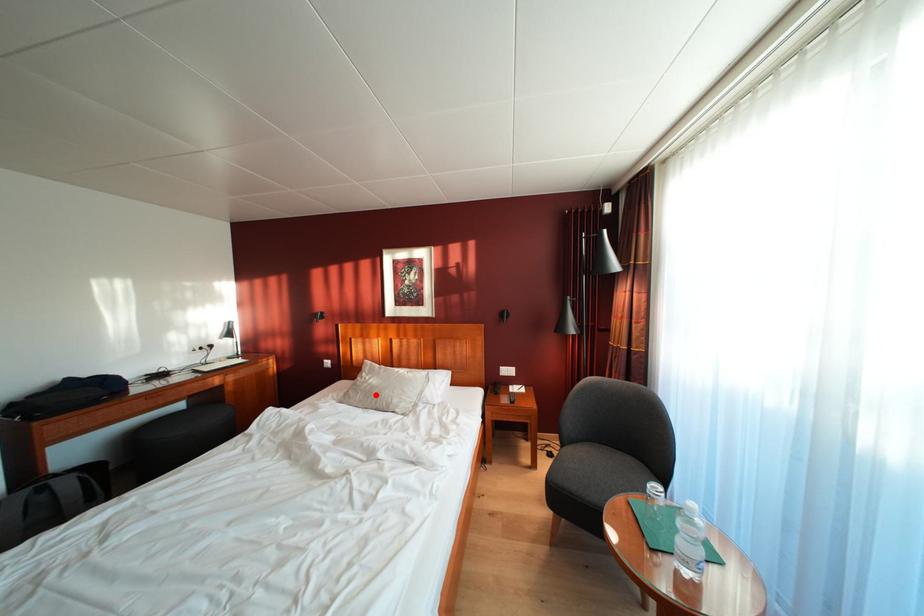
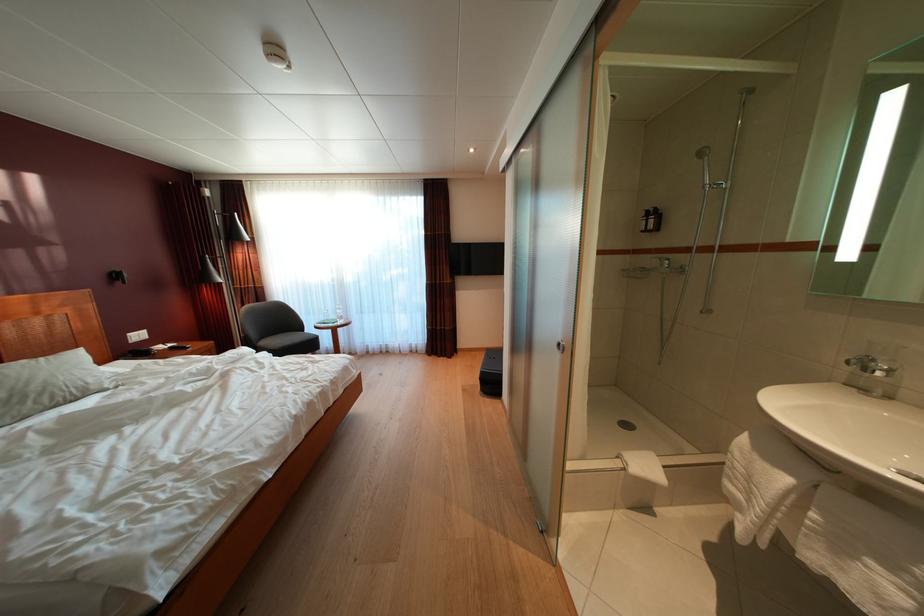
Question: I am providing you with two images of the same scene from different viewpoints. Given a red point in image1, look at the same physical point in image2. Is it:

Choices:
 (A) Closer to the viewpoint
 (B) Farther from the viewpoint

Answer: (A)